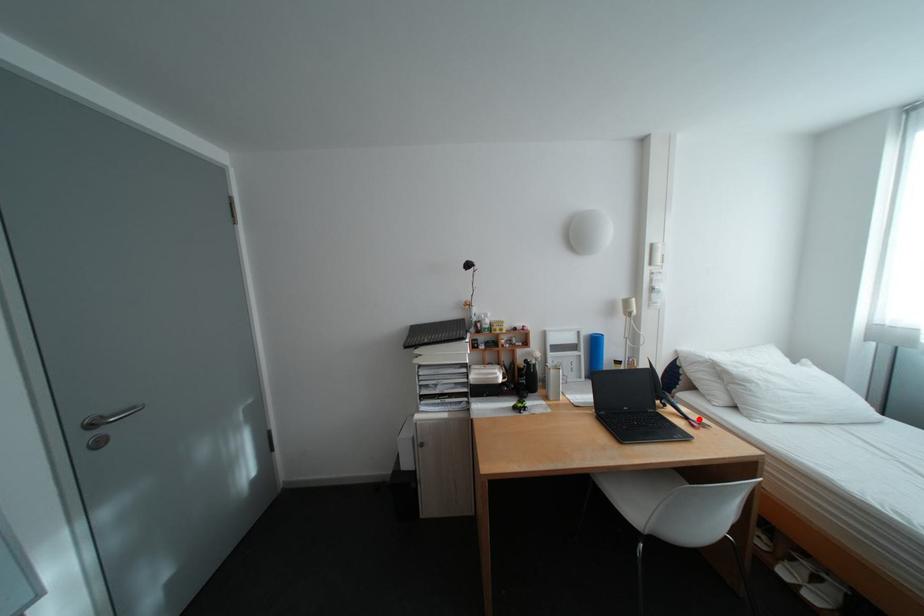
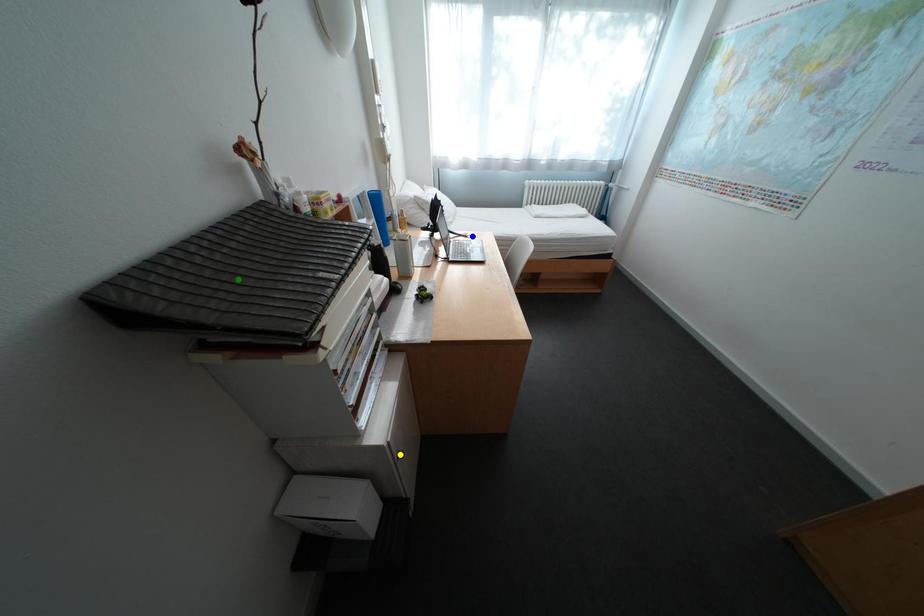
Question: I am providing you with two images of the same scene from different viewpoints. A red point is marked on the first image. You are given multiple points on the second image. Which point in image 2 is actually the same real-world point as the red point in image 1?

Choices:
 (A) blue point
 (B) green point
 (C) yellow point

Answer: (A)